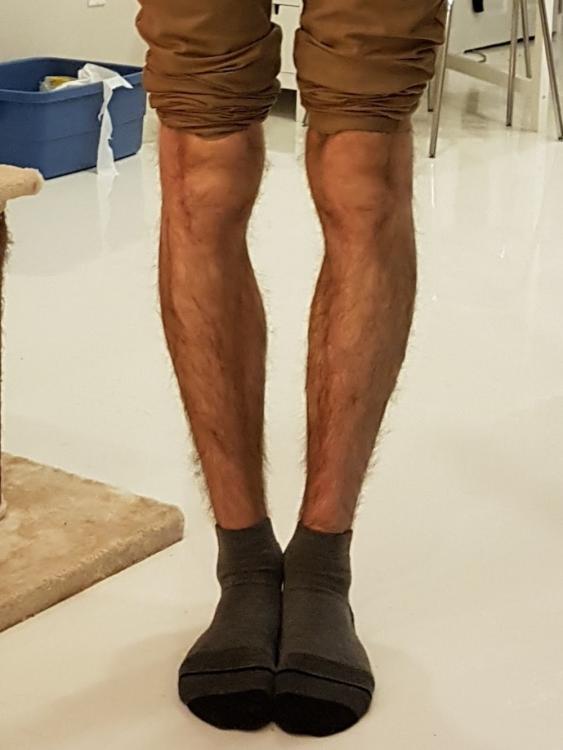
At what (x,y) coordinates should I click in order to perform the action: click on silver legs to stool. Please return your answer as a coordinate pair (x, y). The image size is (563, 750). Looking at the image, I should click on (513, 84), (195, 4).